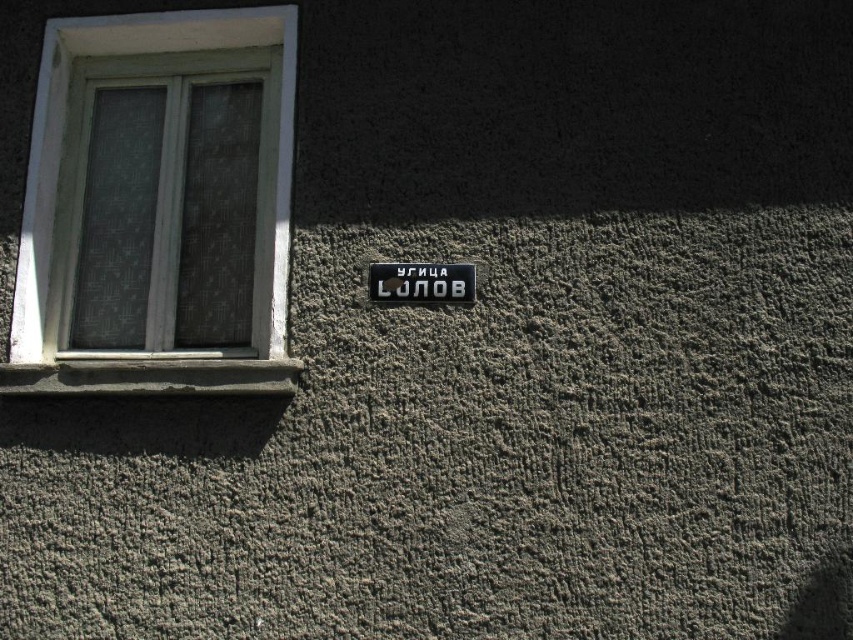
Question: Which point is closer to the camera?

Choices:
 (A) black plastic sign at center
 (B) white plastic window at upper left

Answer: (B)

Question: Which point is farther to the camera?

Choices:
 (A) black plastic sign at center
 (B) white plastic window at upper left

Answer: (A)

Question: Is white plastic window at upper left thinner than black plastic sign at center?

Choices:
 (A) yes
 (B) no

Answer: (B)

Question: Is white plastic window at upper left bigger than black plastic sign at center?

Choices:
 (A) yes
 (B) no

Answer: (A)

Question: Is white plastic window at upper left above black plastic sign at center?

Choices:
 (A) no
 (B) yes

Answer: (B)